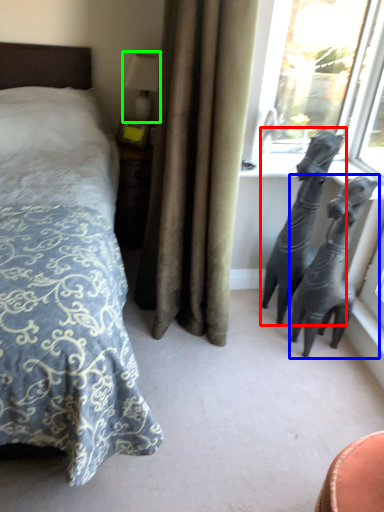
Question: Which object is the closest to the animal (highlighted by a red box)? Choose among these: bronze sculpture (highlighted by a blue box) or table lamp (highlighted by a green box).

Choices:
 (A) bronze sculpture
 (B) table lamp

Answer: (A)